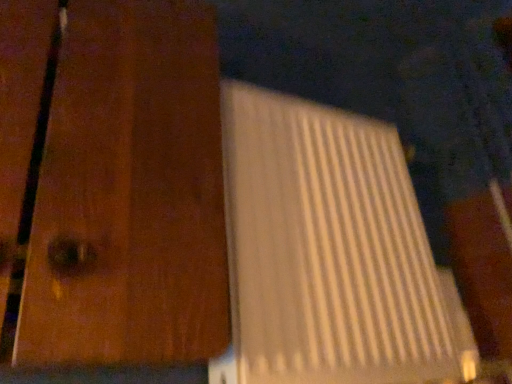
Question: Do you think white matte door at center is within white plastic laptop at center, or outside of it?

Choices:
 (A) outside
 (B) inside

Answer: (A)

Question: In the image, is white matte door at center on the left side or the right side of white plastic laptop at center?

Choices:
 (A) left
 (B) right

Answer: (A)

Question: From the image's perspective, is white matte door at center located above or below white plastic laptop at center?

Choices:
 (A) above
 (B) below

Answer: (A)

Question: Considering the positions of point (289, 150) and point (124, 18), is point (289, 150) closer or farther from the camera than point (124, 18)?

Choices:
 (A) closer
 (B) farther

Answer: (B)

Question: From the image's perspective, is white plastic laptop at center located above or below white matte door at center?

Choices:
 (A) above
 (B) below

Answer: (B)

Question: In the image, is white plastic laptop at center positioned in front of or behind white matte door at center?

Choices:
 (A) behind
 (B) front

Answer: (A)

Question: In terms of width, does white plastic laptop at center look wider or thinner when compared to white matte door at center?

Choices:
 (A) wide
 (B) thin

Answer: (B)